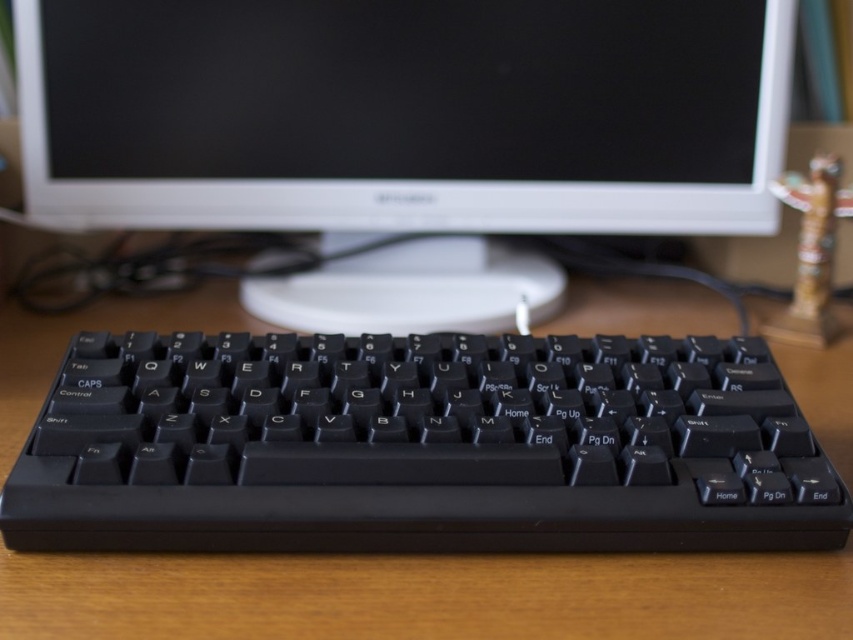
You are setting up a new workspace and want to place the black plastic keyboard at center so that it aligns with the center of the black matte monitor at upper center. Given their widths, will the keyboard fit entirely within the monitor when centered?

The black matte monitor at upper center is wider than the black plastic keyboard at center. Therefore, when centered, the keyboard will fit entirely within the monitor since its width is narrower than the monitor.

You are a user trying to reach the black matte monitor at upper center to turn it on. You are currently at the position of the black plastic keyboard at center. Which direction should you move to reach the monitor?

The black matte monitor at upper center is further to the viewer than the black plastic keyboard at center, so you should move forward towards the monitor to reach it.

You are setting up a computer desk and need to ensure proper cable management. The black matte monitor at upper center and the black plastic keyboard at center are both connected to the same computer tower. Since the monitor is above the keyboard, where should you route the cables to avoid tangling?

The black matte monitor at upper center is positioned over the black plastic keyboard at center, so you should route the cables behind the monitor to keep them out of the way of the keyboard.